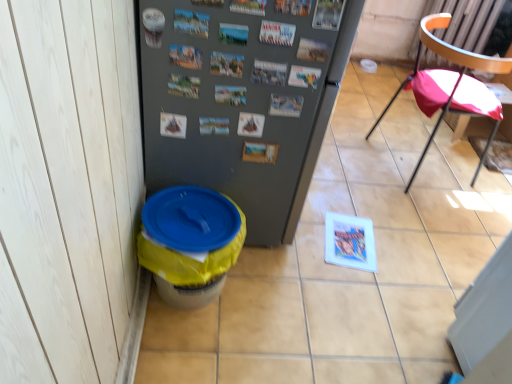
Where is `vacant space in front of gray matte refrigerator at center`? This screenshot has height=384, width=512. vacant space in front of gray matte refrigerator at center is located at coordinates (264, 321).